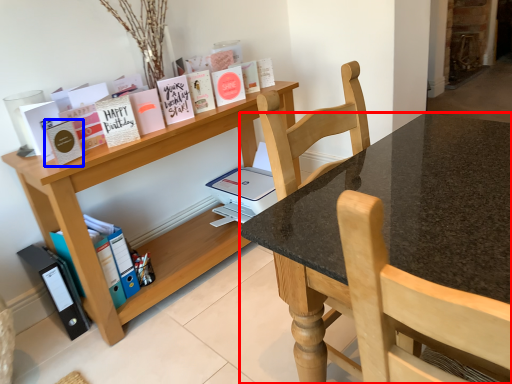
Question: Which object is further to the camera taking this photo, desk (highlighted by a red box) or paperback book (highlighted by a blue box)?

Choices:
 (A) desk
 (B) paperback book

Answer: (B)